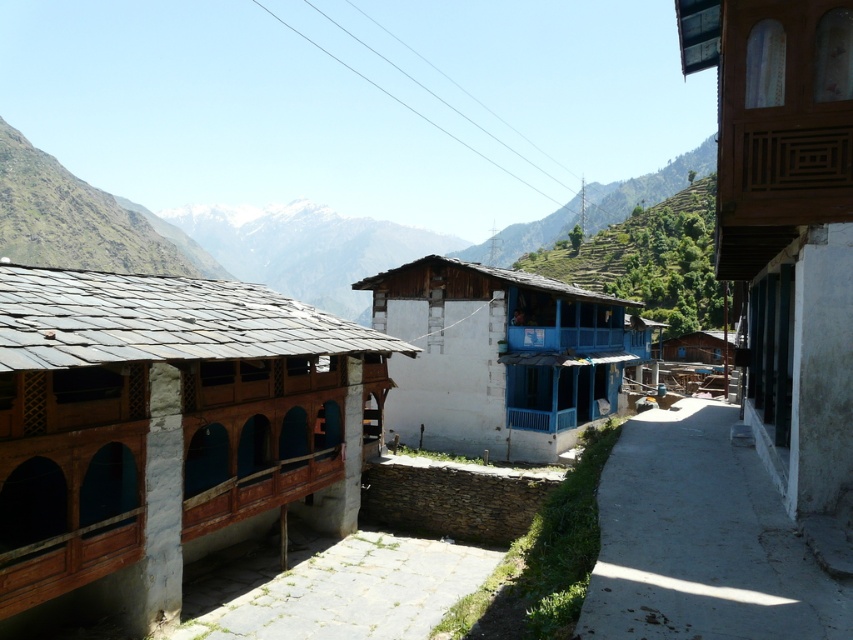
Question: Can you confirm if stone/rough wall hut at left is positioned to the left of wooden balcony at right?

Choices:
 (A) no
 (B) yes

Answer: (B)

Question: Which is nearer to the wooden balcony at right?

Choices:
 (A) stone/rough wall hut at left
 (B) green grassy mountain at upper left

Answer: (A)

Question: Is wooden balcony at right to the right of green grassy mountain at upper left from the viewer's perspective?

Choices:
 (A) no
 (B) yes

Answer: (B)

Question: Which point appears closest to the camera in this image?

Choices:
 (A) (524, 396)
 (B) (706, 586)
 (C) (747, 77)

Answer: (B)

Question: Which of these objects is positioned farthest from the wooden balcony at right?

Choices:
 (A) concrete at center
 (B) stone/rough wall hut at left
 (C) green grassy hillside at center

Answer: (C)

Question: Can you confirm if green grassy mountain at upper left is positioned below green grassy hillside at center?

Choices:
 (A) yes
 (B) no

Answer: (A)